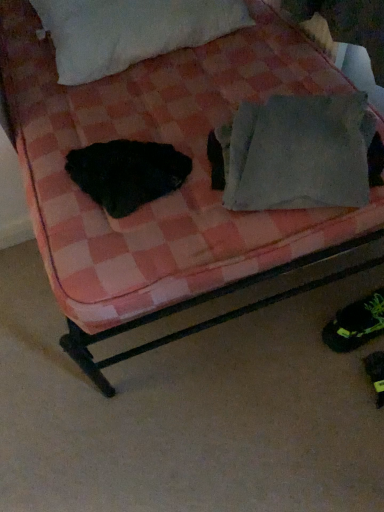
This screenshot has height=512, width=384. Find the location of `vacant space in front of green synthetic shoe at lower right`. vacant space in front of green synthetic shoe at lower right is located at coordinates (345, 377).